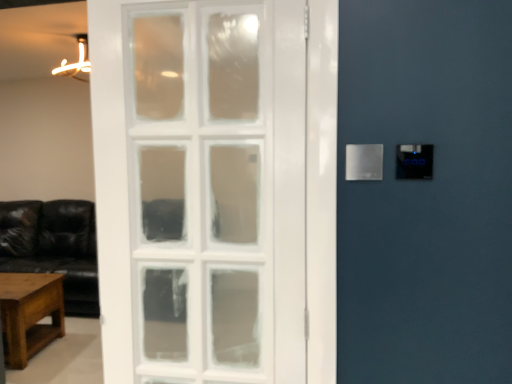
Question: Based on their positions, is wooden coffee table at lower left located to the left or right of satin silver panel at right?

Choices:
 (A) left
 (B) right

Answer: (A)

Question: From a real-world perspective, is wooden coffee table at lower left physically located above or below satin silver panel at right?

Choices:
 (A) below
 (B) above

Answer: (A)

Question: From their relative heights in the image, would you say wooden coffee table at lower left is taller or shorter than satin silver panel at right?

Choices:
 (A) tall
 (B) short

Answer: (A)

Question: Does point (348, 170) appear closer or farther from the camera than point (60, 312)?

Choices:
 (A) farther
 (B) closer

Answer: (B)

Question: Relative to wooden coffee table at lower left, is satin silver panel at right in front or behind?

Choices:
 (A) front
 (B) behind

Answer: (A)

Question: From the image's perspective, is satin silver panel at right positioned above or below wooden coffee table at lower left?

Choices:
 (A) below
 (B) above

Answer: (B)

Question: Visually, is satin silver panel at right positioned to the left or to the right of wooden coffee table at lower left?

Choices:
 (A) right
 (B) left

Answer: (A)